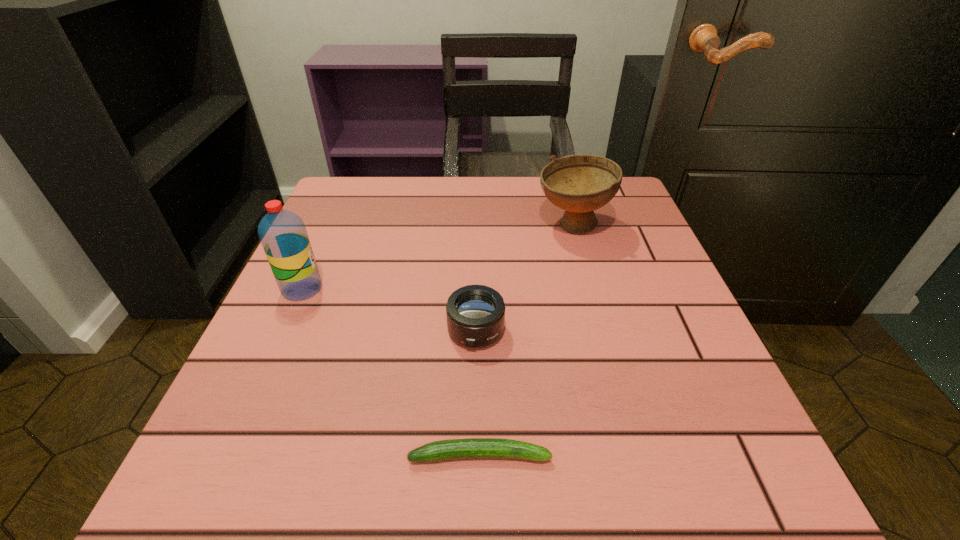
The width and height of the screenshot is (960, 540). Identify the location of water bottle. point(282,233).

Identify the location of the leftmost object. The height and width of the screenshot is (540, 960). pos(282,233).

Identify the location of the farthest object. (579, 184).

Where is `the third shortest object`? The width and height of the screenshot is (960, 540). the third shortest object is located at coordinates (579, 184).

This screenshot has height=540, width=960. Identify the location of the second shortest object. (475, 314).

This screenshot has width=960, height=540. What are the coordinates of `the third farthest object` in the screenshot? It's located at (475, 314).

Find the location of a particular element. zucchini is located at coordinates (472, 448).

What are the coordinates of `the shortest object` in the screenshot? It's located at (472, 448).

Locate an element on the screen. free space located 0.350m on the front label of the second farthest object is located at coordinates (509, 289).

Locate an element on the screen. Image resolution: width=960 pixels, height=540 pixels. vacant area located on the right of the soup bowl is located at coordinates (645, 226).